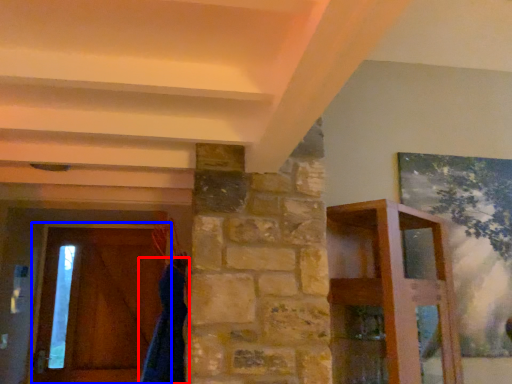
Question: Which point is further to the camera, robe (highlighted by a red box) or barn door (highlighted by a blue box)?

Choices:
 (A) robe
 (B) barn door

Answer: (B)